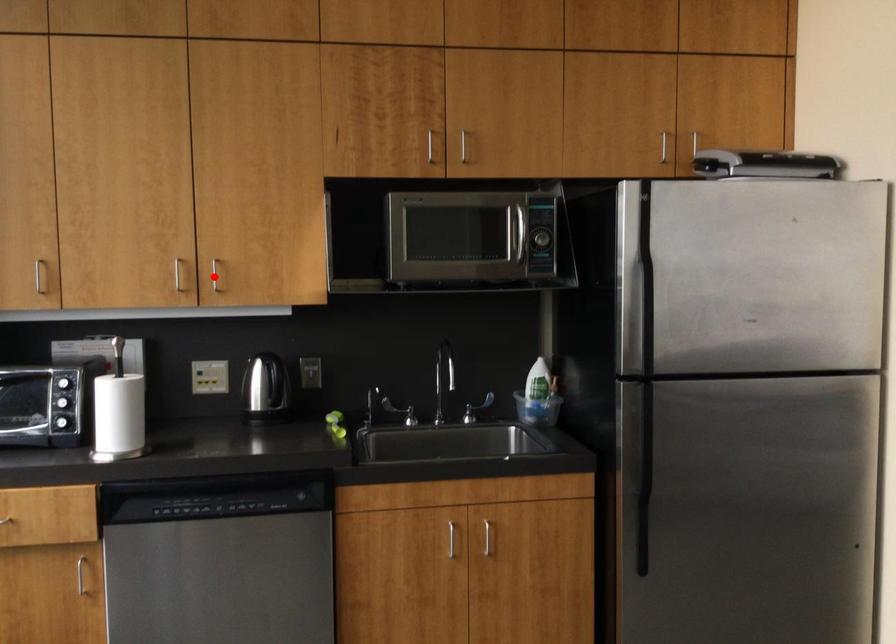
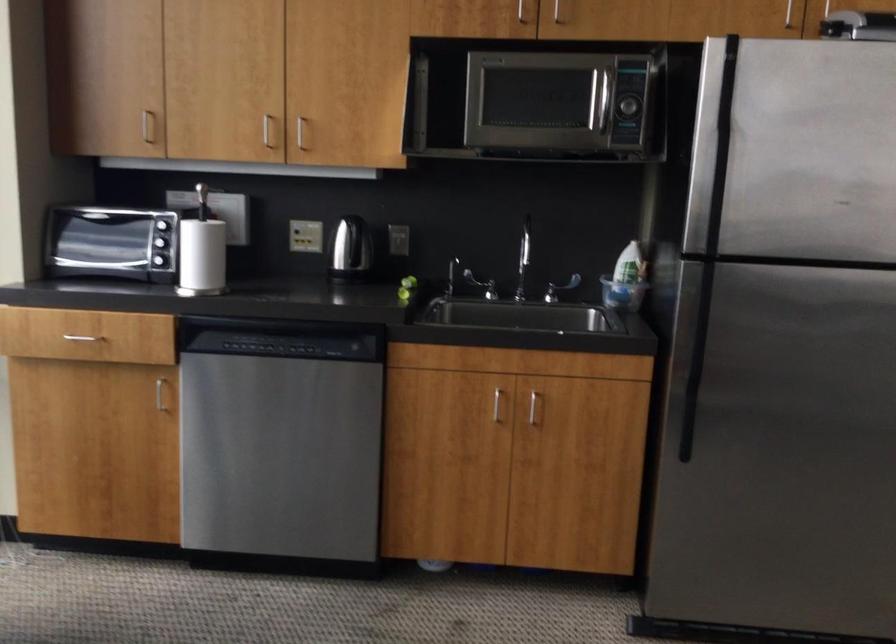
Find the pixel in the second image that matches the highlighted location in the first image.

(300, 131)